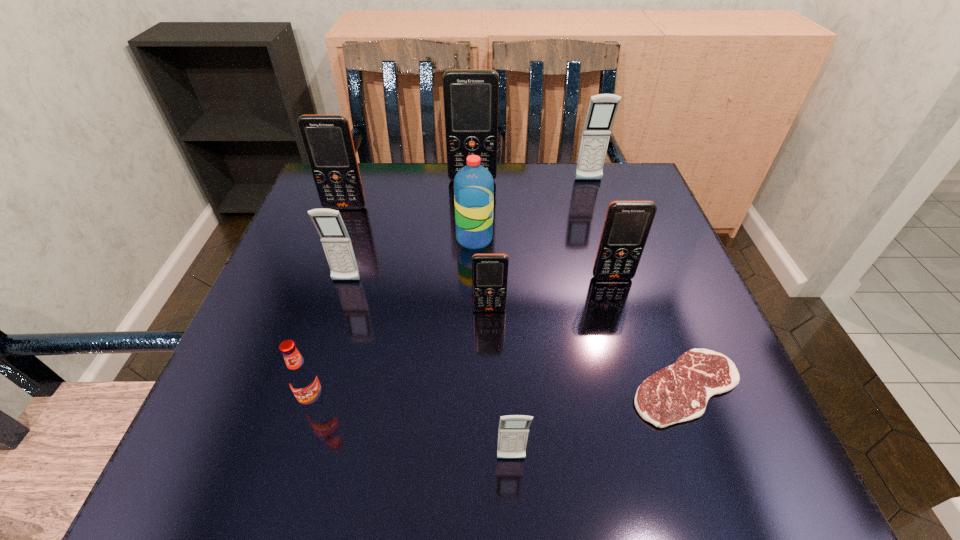
Where is `the third farthest orange cellular telephone`? The image size is (960, 540). the third farthest orange cellular telephone is located at coordinates (627, 224).

This screenshot has width=960, height=540. Identify the location of the rightmost orange cellular telephone. (627, 224).

Identify the location of root beer. The width and height of the screenshot is (960, 540). (302, 377).

This screenshot has width=960, height=540. Identify the location of the nearest orange cellular telephone. (489, 271).

Where is `the smallest orange cellular telephone`? The image size is (960, 540). the smallest orange cellular telephone is located at coordinates coord(489,271).

Where is `the second gray cellular telephone from right to left`? This screenshot has width=960, height=540. the second gray cellular telephone from right to left is located at coordinates (513, 430).

Image resolution: width=960 pixels, height=540 pixels. Find the location of `the nearest cellular telephone`. the nearest cellular telephone is located at coordinates (513, 430).

This screenshot has height=540, width=960. What are the coordinates of `red steak` in the screenshot? It's located at (680, 392).

This screenshot has width=960, height=540. I want to click on the shortest object, so click(x=680, y=392).

The height and width of the screenshot is (540, 960). Find the location of `vacant region located 0.210m on the screen of the tallest object`. vacant region located 0.210m on the screen of the tallest object is located at coordinates (471, 237).